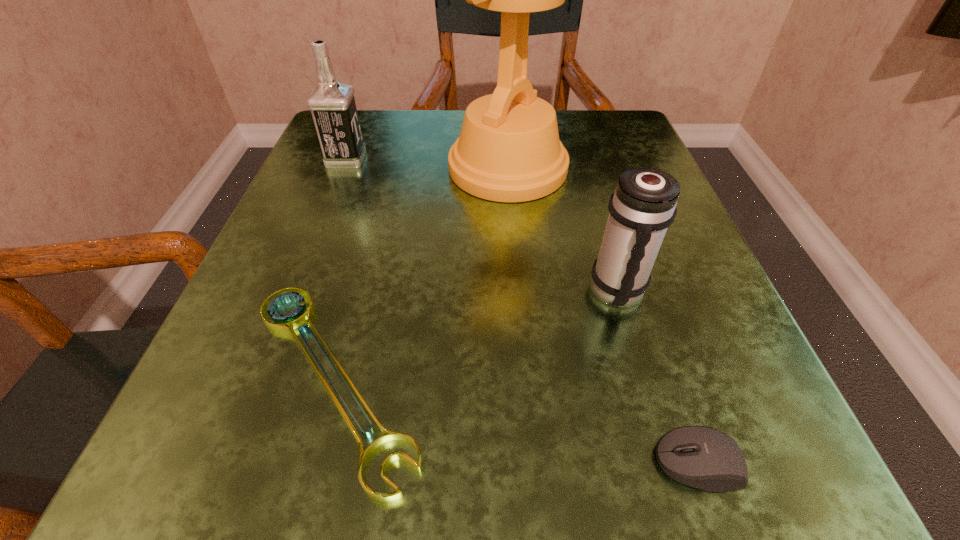
Find the location of a particular element. award positioned at the far edge is located at coordinates (508, 150).

You are a GUI agent. You are given a task and a screenshot of the screen. Output one action in this format:
    pyautogui.click(x=<x>, y=<y>)
    Task: Click on the vodka that is at the far edge
    This screenshot has height=540, width=960.
    Given the screenshot: What is the action you would take?
    pyautogui.click(x=332, y=103)

I want to click on computer equipment at the near edge, so click(x=702, y=457).

I want to click on wrench situated at the near edge, so click(286, 323).

Find the location of a particular element. The image size is (960, 540). vodka at the left edge is located at coordinates (332, 103).

Locate an element on the screen. The image size is (960, 540). wrench present at the left edge is located at coordinates (286, 323).

I want to click on thermos bottle that is at the right edge, so click(643, 206).

You are a GUI agent. You are given a task and a screenshot of the screen. Output one action in this format:
    pyautogui.click(x=<x>, y=<y>)
    Task: Click on the computer equipment positioned at the right edge
    This screenshot has width=960, height=540.
    Given the screenshot: What is the action you would take?
    pyautogui.click(x=702, y=457)

Locate an element on the screen. object that is at the far left corner is located at coordinates (332, 103).

Image resolution: width=960 pixels, height=540 pixels. What are the coordinates of `object that is at the near left corner` in the screenshot? It's located at (286, 323).